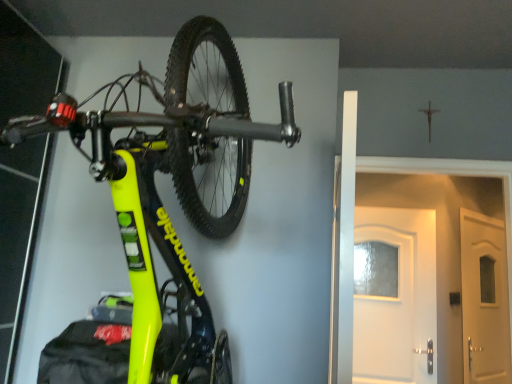
Question: Is white matte door at center smaller than neon yellow matte bicycle at upper left?

Choices:
 (A) no
 (B) yes

Answer: (B)

Question: Is white matte door at center to the left of neon yellow matte bicycle at upper left from the viewer's perspective?

Choices:
 (A) yes
 (B) no

Answer: (B)

Question: Is white matte door at center completely or partially outside of neon yellow matte bicycle at upper left?

Choices:
 (A) yes
 (B) no

Answer: (A)

Question: From the image's perspective, would you say white matte door at center is shown under neon yellow matte bicycle at upper left?

Choices:
 (A) yes
 (B) no

Answer: (A)

Question: Is white matte door at center taller than neon yellow matte bicycle at upper left?

Choices:
 (A) yes
 (B) no

Answer: (B)

Question: Considering the relative sizes of white matte door at center and neon yellow matte bicycle at upper left in the image provided, is white matte door at center bigger than neon yellow matte bicycle at upper left?

Choices:
 (A) yes
 (B) no

Answer: (B)

Question: Is neon yellow matte bicycle at upper left to the left of white matte door at center from the viewer's perspective?

Choices:
 (A) no
 (B) yes

Answer: (B)

Question: Is neon yellow matte bicycle at upper left in contact with white matte door at center?

Choices:
 (A) no
 (B) yes

Answer: (A)

Question: Does neon yellow matte bicycle at upper left have a smaller size compared to white matte door at center?

Choices:
 (A) yes
 (B) no

Answer: (B)

Question: Is the position of neon yellow matte bicycle at upper left more distant than that of white matte door at center?

Choices:
 (A) yes
 (B) no

Answer: (B)

Question: Is white matte door at center completely or partially inside neon yellow matte bicycle at upper left?

Choices:
 (A) yes
 (B) no

Answer: (B)

Question: Is neon yellow matte bicycle at upper left far away from white matte door at center?

Choices:
 (A) no
 (B) yes

Answer: (A)

Question: From the image's perspective, is white matte door at center above or below neon yellow matte bicycle at upper left?

Choices:
 (A) below
 (B) above

Answer: (A)